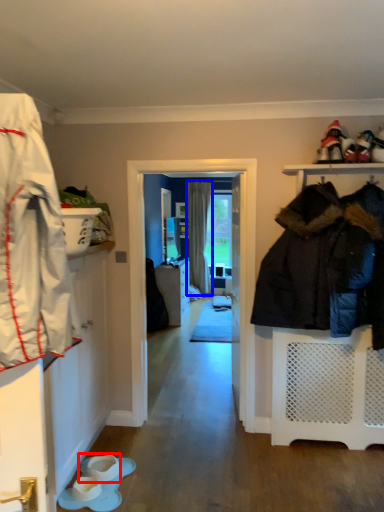
Question: Which of the following is the closest to the observer, footwear (highlighted by a red box) or curtain (highlighted by a blue box)?

Choices:
 (A) footwear
 (B) curtain

Answer: (A)